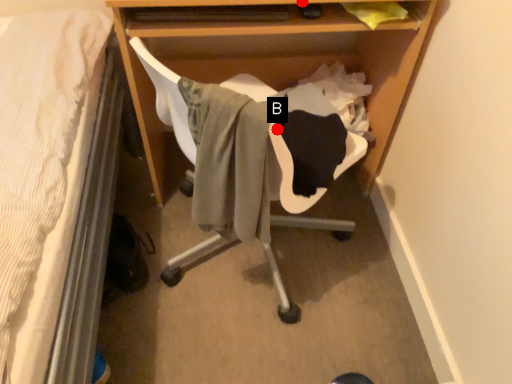
Question: Two points are circled on the image, labeled by A and B beside each circle. Which point is farther to the camera?

Choices:
 (A) A is further
 (B) B is further

Answer: (A)